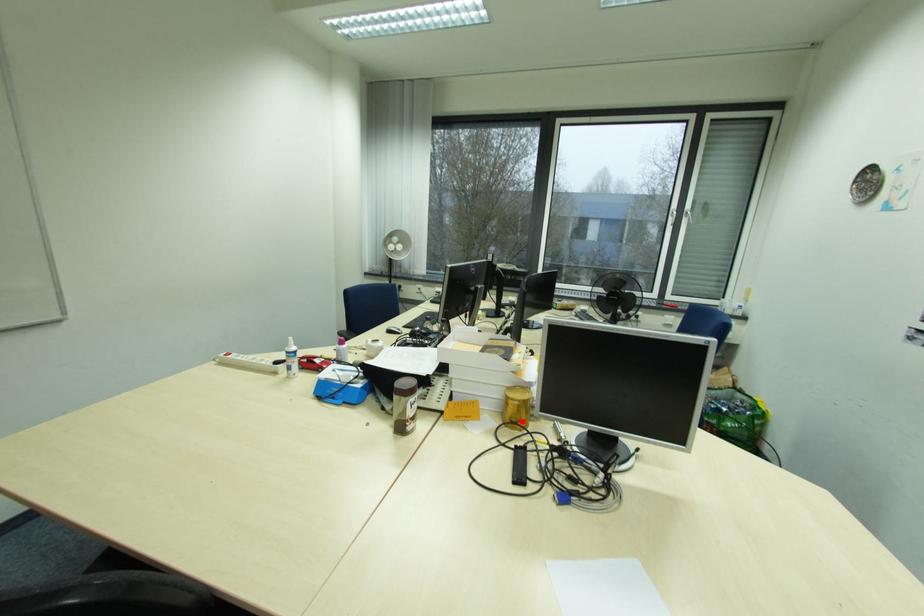
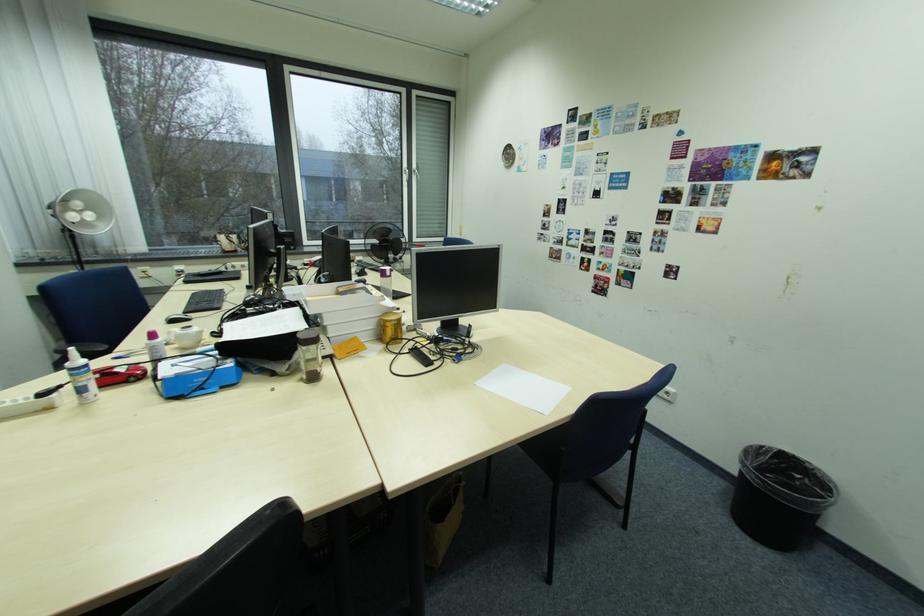
Question: I am providing you with two images of the same scene from different viewpoints. In image1, a red point is highlighted. Considering the same 3D point in image2, which of the following is correct?

Choices:
 (A) It is closer
 (B) It is farther

Answer: (A)